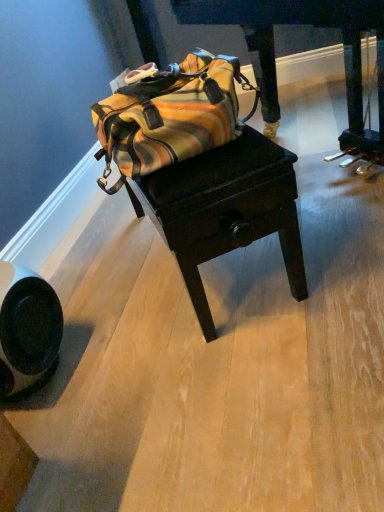
Find the location of a particular element. The image size is (384, 512). free area below wooden table at center (from a real-world perspective) is located at coordinates (216, 269).